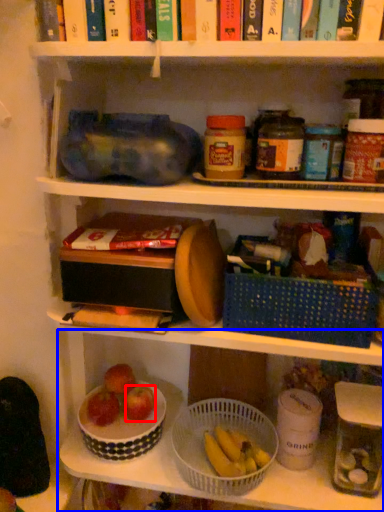
Question: Among these objects, which one is farthest to the camera, apple (highlighted by a red box) or shelf (highlighted by a blue box)?

Choices:
 (A) apple
 (B) shelf

Answer: (A)